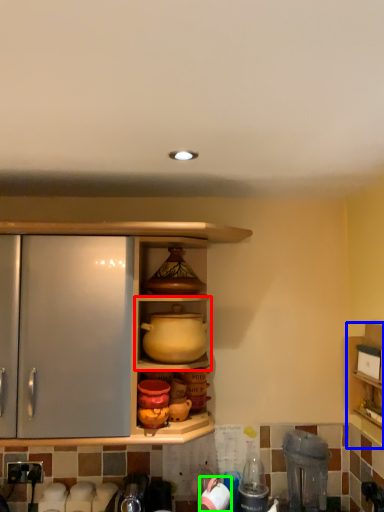
Question: Considering the real-world distances, which object is farthest from shelf (highlighted by a red box)? shelf (highlighted by a blue box) or appliance (highlighted by a green box)?

Choices:
 (A) shelf
 (B) appliance

Answer: (A)